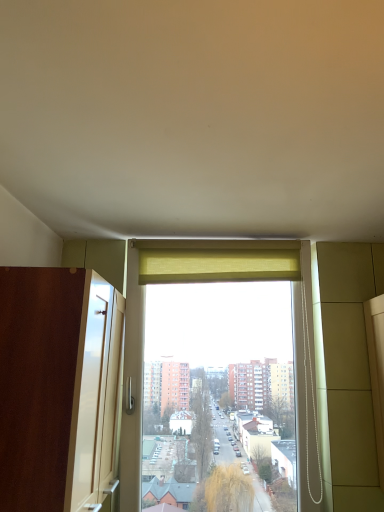
Question: Considering the relative sizes of brown wood screen door at left and yellow fabric curtain at upper center in the image provided, is brown wood screen door at left bigger than yellow fabric curtain at upper center?

Choices:
 (A) no
 (B) yes

Answer: (B)

Question: Is the depth of brown wood screen door at left greater than that of yellow fabric curtain at upper center?

Choices:
 (A) yes
 (B) no

Answer: (B)

Question: From a real-world perspective, does brown wood screen door at left stand above yellow fabric curtain at upper center?

Choices:
 (A) no
 (B) yes

Answer: (A)

Question: Does brown wood screen door at left have a lesser width compared to yellow fabric curtain at upper center?

Choices:
 (A) no
 (B) yes

Answer: (A)

Question: From the image's perspective, does brown wood screen door at left appear higher than yellow fabric curtain at upper center?

Choices:
 (A) yes
 (B) no

Answer: (B)

Question: Is brown wood screen door at left far away from yellow fabric curtain at upper center?

Choices:
 (A) yes
 (B) no

Answer: (B)

Question: Would you say brown wood screen door at left is part of yellow fabric curtain at upper center's contents?

Choices:
 (A) yes
 (B) no

Answer: (B)

Question: Does yellow fabric curtain at upper center turn towards brown wood screen door at left?

Choices:
 (A) no
 (B) yes

Answer: (A)

Question: Can you confirm if yellow fabric curtain at upper center is taller than brown wood screen door at left?

Choices:
 (A) yes
 (B) no

Answer: (B)

Question: From the image's perspective, is yellow fabric curtain at upper center beneath brown wood screen door at left?

Choices:
 (A) yes
 (B) no

Answer: (B)

Question: Does yellow fabric curtain at upper center appear on the right side of brown wood screen door at left?

Choices:
 (A) no
 (B) yes

Answer: (B)

Question: Is yellow fabric curtain at upper center thinner than brown wood screen door at left?

Choices:
 (A) yes
 (B) no

Answer: (A)

Question: From a real-world perspective, is yellow fabric curtain at upper center physically located above or below brown wood screen door at left?

Choices:
 (A) below
 (B) above

Answer: (B)